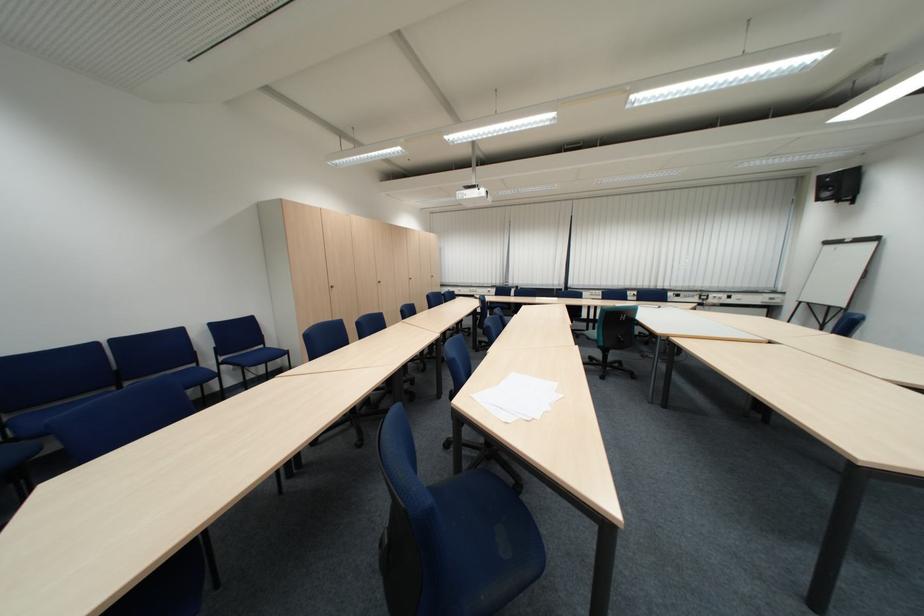
What are the coordinates of `chair sitting surface` in the screenshot? It's located at (254, 357).